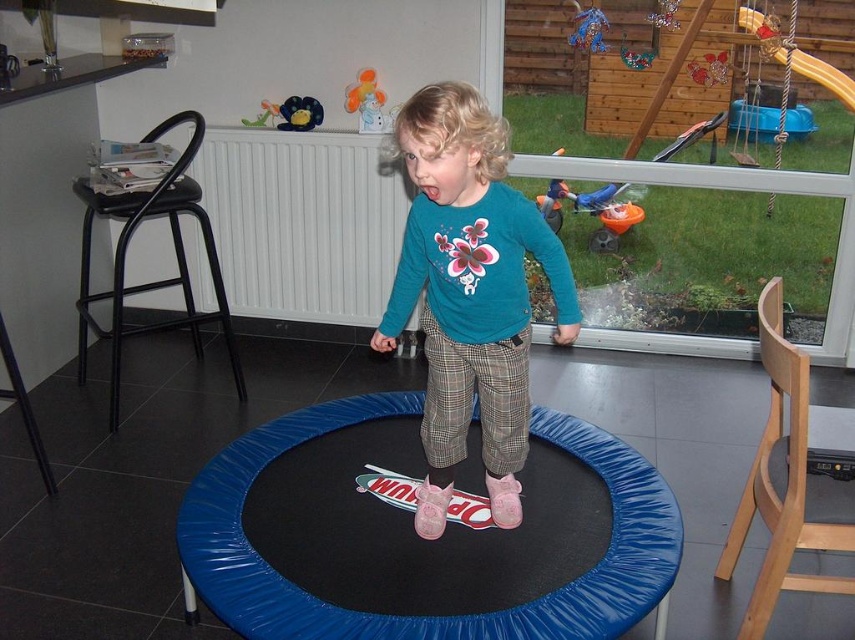
Question: Which object is closer to the camera taking this photo?

Choices:
 (A) green plastic toy at upper center
 (B) matte plastic toy at upper center

Answer: (B)

Question: In this image, where is teal fabric shirt at center located relative to blue rubber mat at center?

Choices:
 (A) above
 (B) below

Answer: (A)

Question: Which object is farther from the camera taking this photo?

Choices:
 (A) blue rubber mat at center
 (B) teal fabric shirt at center
 (C) green plastic toy at upper center

Answer: (C)

Question: Does orange plastic wheelbarrow at center have a greater width compared to matte plastic toy at upper center?

Choices:
 (A) no
 (B) yes

Answer: (B)

Question: Which point appears farthest from the camera in this image?

Choices:
 (A) (305, 612)
 (B) (260, 100)
 (C) (367, 77)
 (D) (556, 182)

Answer: (D)

Question: Is teal fabric shirt at center further to camera compared to blue rubber mat at center?

Choices:
 (A) yes
 (B) no

Answer: (B)